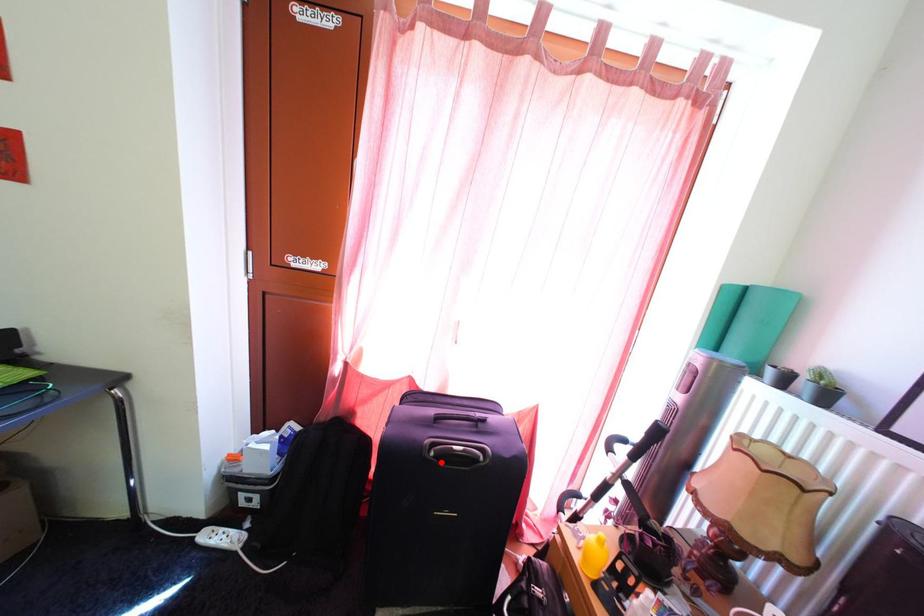
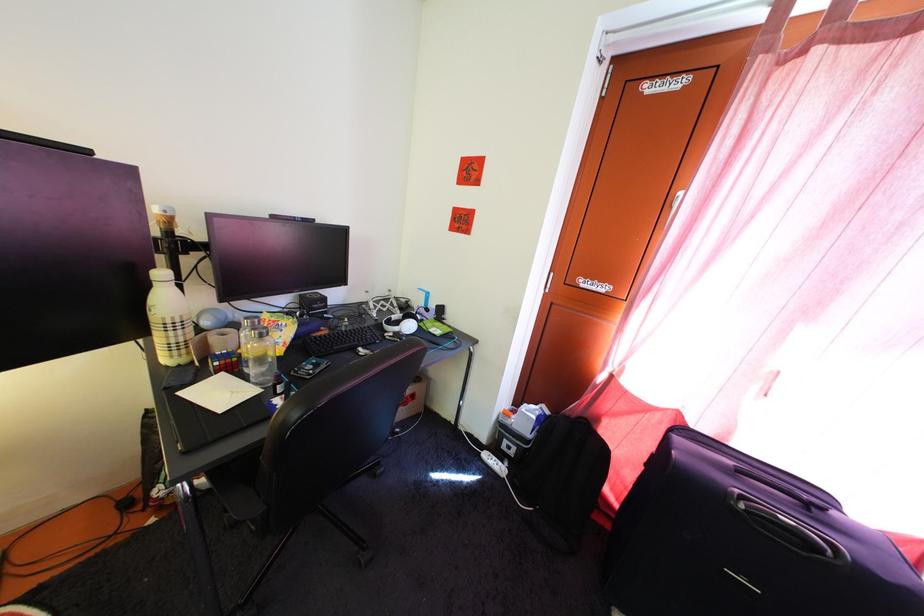
Locate, in the second image, the point that corresponds to the highlighted location in the first image.

(751, 515)